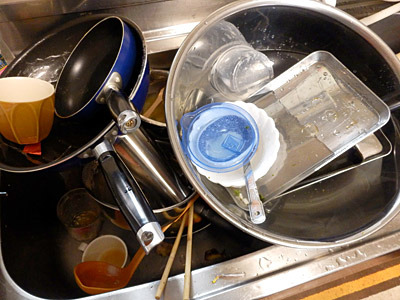
The height and width of the screenshot is (300, 400). In order to click on countertop surrounding sink in this screenshot , I will do `click(380, 298)`.